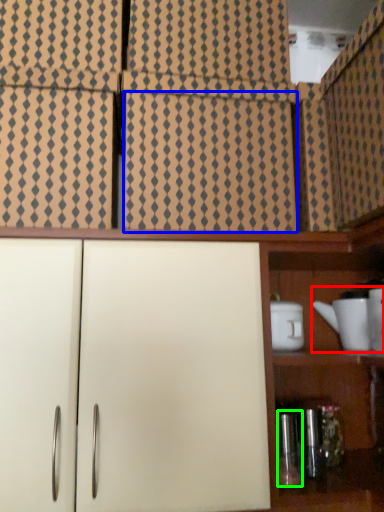
Question: Which object is positioned closest to tea set (highlighted by a red box)? Select from tile (highlighted by a blue box) and bottle (highlighted by a green box).

Choices:
 (A) tile
 (B) bottle

Answer: (B)